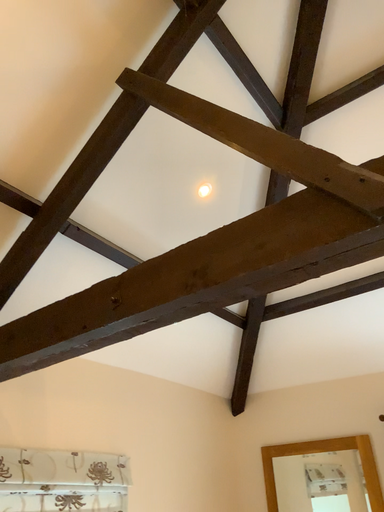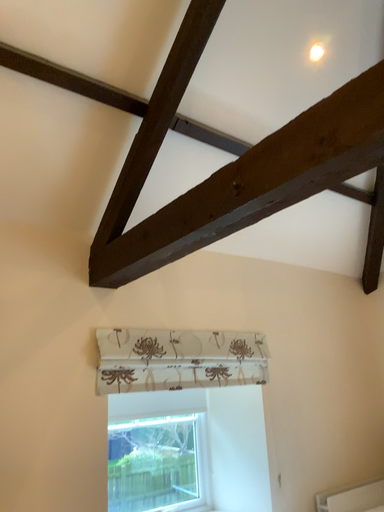
Question: Which way did the camera rotate in the video?

Choices:
 (A) rotated downward
 (B) rotated upward

Answer: (A)